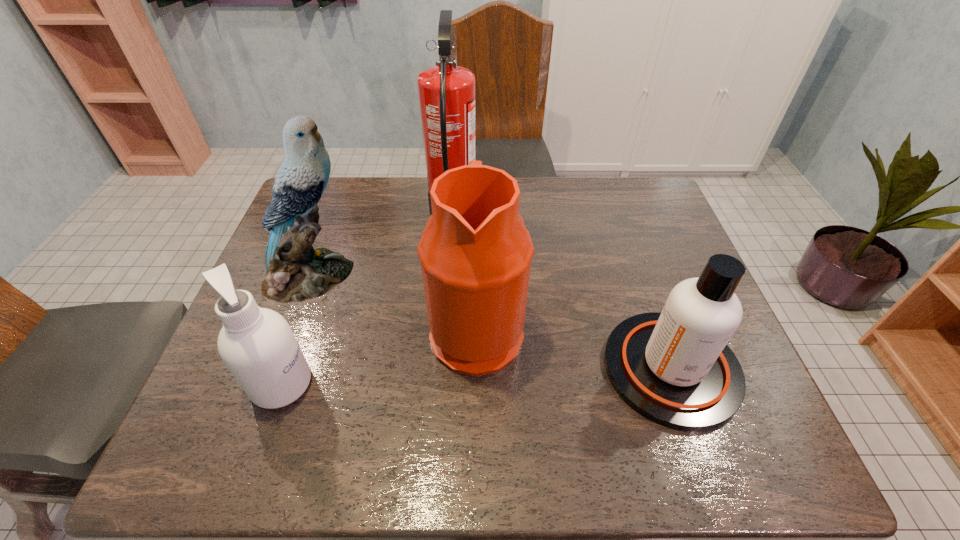
The height and width of the screenshot is (540, 960). What are the coordinates of `the tallest object` in the screenshot? It's located at (446, 91).

This screenshot has height=540, width=960. What are the coordinates of `fire extinguisher` in the screenshot? It's located at (446, 91).

The height and width of the screenshot is (540, 960). What are the coordinates of `parakeet` in the screenshot? It's located at (296, 272).

Where is `water jug`? Image resolution: width=960 pixels, height=540 pixels. water jug is located at coordinates (475, 252).

Image resolution: width=960 pixels, height=540 pixels. I want to click on the left cleansing agent, so click(258, 346).

What are the coordinates of `the rightmost object` in the screenshot? It's located at (674, 367).

Locate an element on the screen. This screenshot has height=540, width=960. free region located on the front-facing side of the tallest object is located at coordinates (532, 217).

Find the location of a particular element. This screenshot has height=540, width=960. vacant region located 0.330m on the face of the parakeet is located at coordinates (481, 276).

This screenshot has height=540, width=960. Find the location of `vacant space situated from the spout of the water jug`. vacant space situated from the spout of the water jug is located at coordinates (675, 330).

This screenshot has height=540, width=960. What are the coordinates of `vacant point located 0.170m on the front label of the left cleansing agent` in the screenshot? It's located at (391, 384).